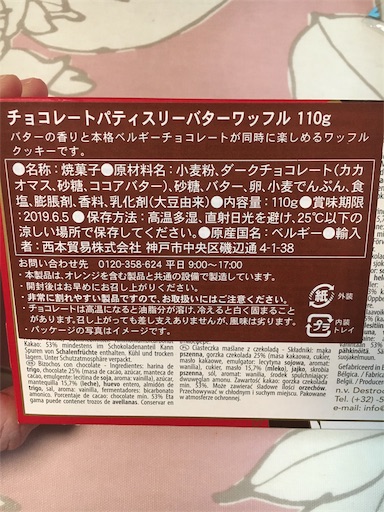
Find the location of a particular element. The image size is (384, 512). column is located at coordinates (93, 366), (221, 362), (369, 369).